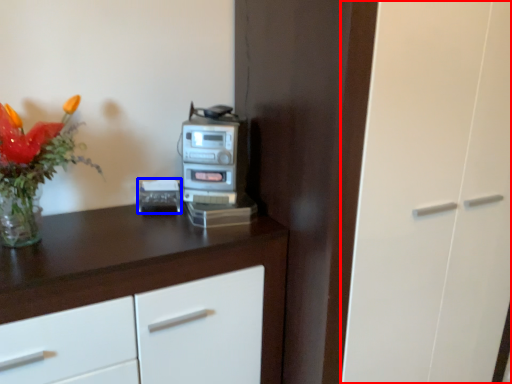
Question: Which point is closer to the camera, glass door (highlighted by a red box) or appliance (highlighted by a blue box)?

Choices:
 (A) glass door
 (B) appliance

Answer: (A)